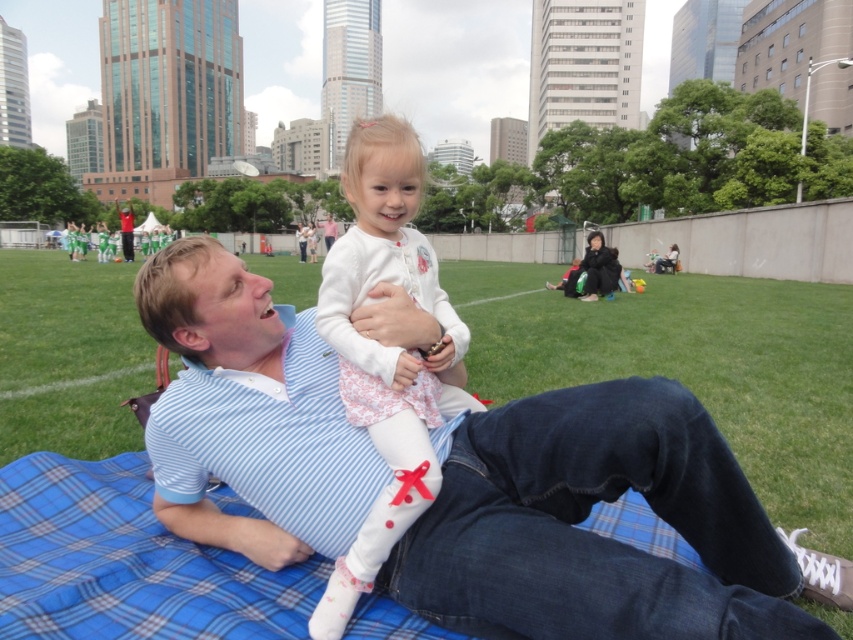
Who is lower down, blue striped shirt at center or white soft fabric at center?

blue striped shirt at center is lower down.

In the scene shown: Measure the distance between blue striped shirt at center and camera.

blue striped shirt at center is 4.01 feet away from camera.

Between point (334, 492) and point (404, 513), which one is positioned in front?

Point (404, 513) is more forward.

I want to click on blue striped shirt at center, so click(592, 534).